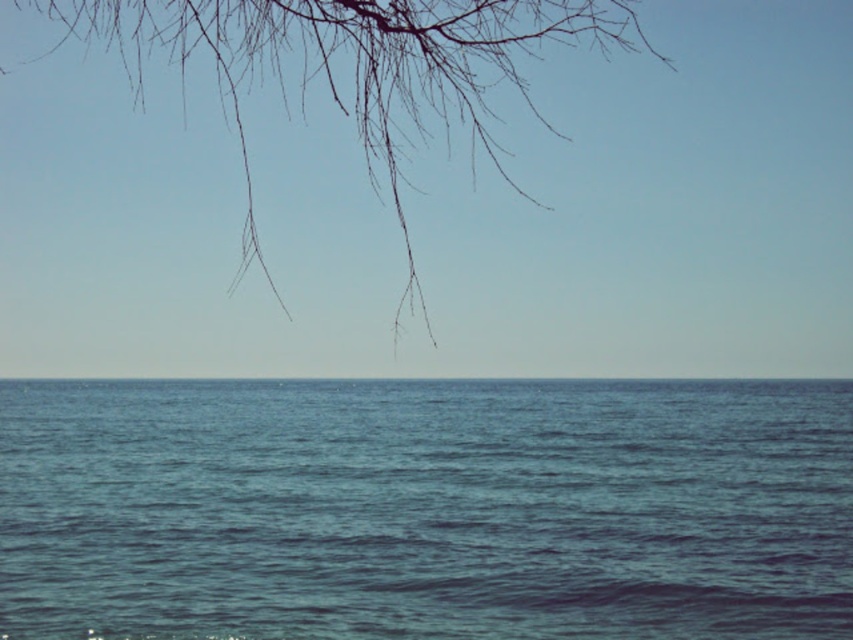
Question: In this image, where is blue liquid water at center located relative to bare branches at upper left?

Choices:
 (A) right
 (B) left

Answer: (B)

Question: Which object is closer to the camera taking this photo?

Choices:
 (A) blue liquid water at center
 (B) bare branches at upper left

Answer: (B)

Question: Which point is closer to the camera?

Choices:
 (A) bare branches at upper left
 (B) blue liquid water at center

Answer: (A)

Question: Which point appears farthest from the camera in this image?

Choices:
 (A) pos(541,464)
 (B) pos(148,19)

Answer: (B)

Question: Does blue liquid water at center come behind bare branches at upper left?

Choices:
 (A) yes
 (B) no

Answer: (A)

Question: Is blue liquid water at center below bare branches at upper left?

Choices:
 (A) no
 (B) yes

Answer: (B)